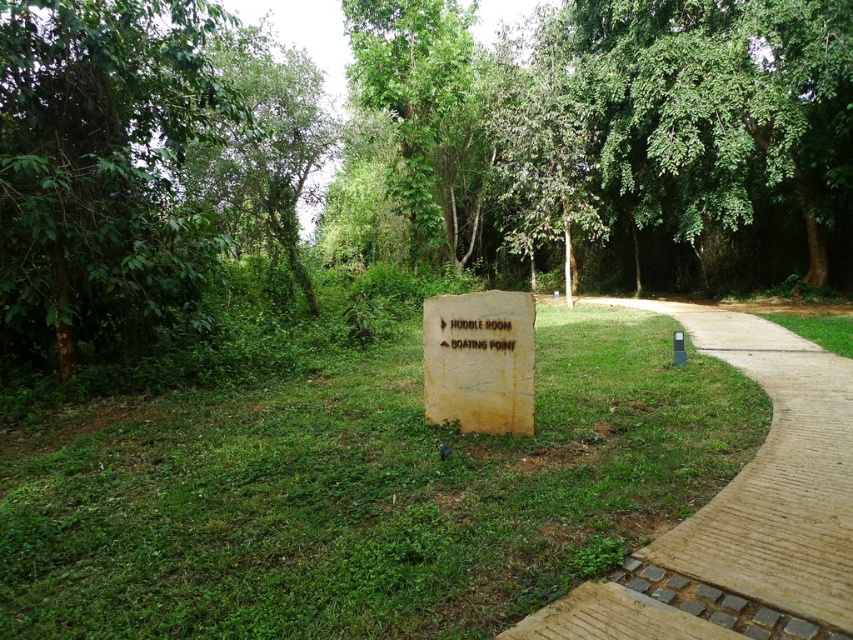
Question: Is green leafy tree at upper center positioned at the back of weathered wood sign at center?

Choices:
 (A) yes
 (B) no

Answer: (A)

Question: Among these points, which one is nearest to the camera?

Choices:
 (A) (439, 173)
 (B) (293, 154)
 (C) (100, 332)
 (D) (784, 400)

Answer: (D)

Question: Does green leafy tree at upper center have a larger size compared to weathered wood sign at center?

Choices:
 (A) yes
 (B) no

Answer: (A)

Question: Which point is farther from the camera taking this photo?

Choices:
 (A) (119, 147)
 (B) (280, 90)
 (C) (672, 625)
 (D) (433, 65)

Answer: (D)

Question: Which point appears farthest from the camera in this image?

Choices:
 (A) (451, 365)
 (B) (120, 19)
 (C) (712, 352)
 (D) (302, 556)

Answer: (C)

Question: Is light brown paved path at center right to the left of green leafy tree at upper center from the viewer's perspective?

Choices:
 (A) yes
 (B) no

Answer: (B)